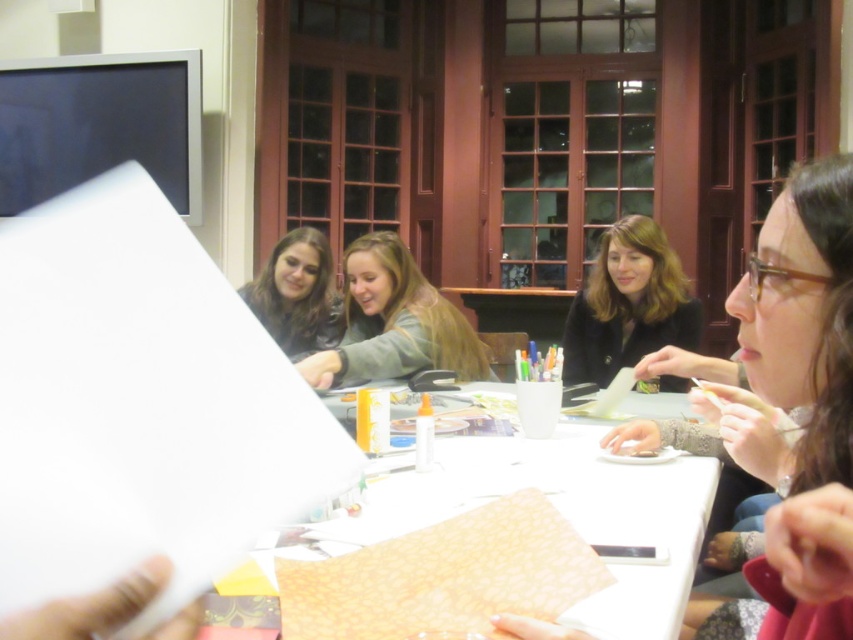
Identify the location of smooth beige sweater at center. This screenshot has width=853, height=640. (393, 323).

Who is more distant from viewer, [347,266] or [671,282]?

Point [671,282]

I want to click on smooth beige sweater at center, so click(x=393, y=323).

Based on the photo, which is more to the right, matte black jacket at center or black matte jacket at center?

From the viewer's perspective, black matte jacket at center appears more on the right side.

Is matte black jacket at center smaller than black matte jacket at center?

No.

Identify the location of matte black jacket at center. This screenshot has width=853, height=640. (795, 406).

Measure the distance between white paper at center and camera.

white paper at center and camera are 23.65 inches apart.

Is point (503, 445) less distant than point (297, 348)?

Yes.

Who is more distant from viewer, (560, 492) or (300, 349)?

Point (300, 349)

Find the location of a particular element. This screenshot has height=640, width=853. white paper at center is located at coordinates (561, 509).